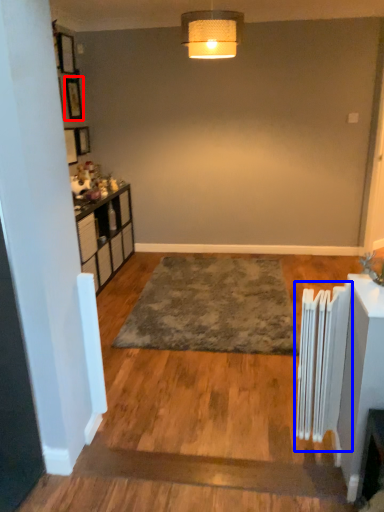
Question: Among these objects, which one is farthest to the camera, picture frame (highlighted by a red box) or radiator (highlighted by a blue box)?

Choices:
 (A) picture frame
 (B) radiator

Answer: (A)